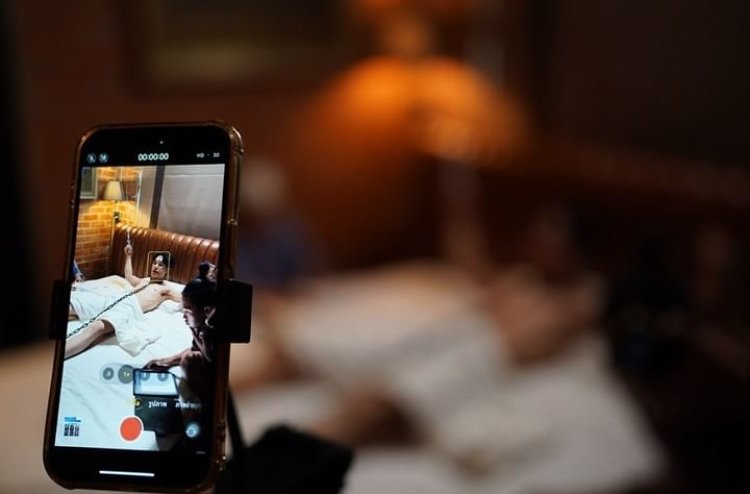
Where is `phone screen`? Image resolution: width=750 pixels, height=494 pixels. phone screen is located at coordinates (177, 208).